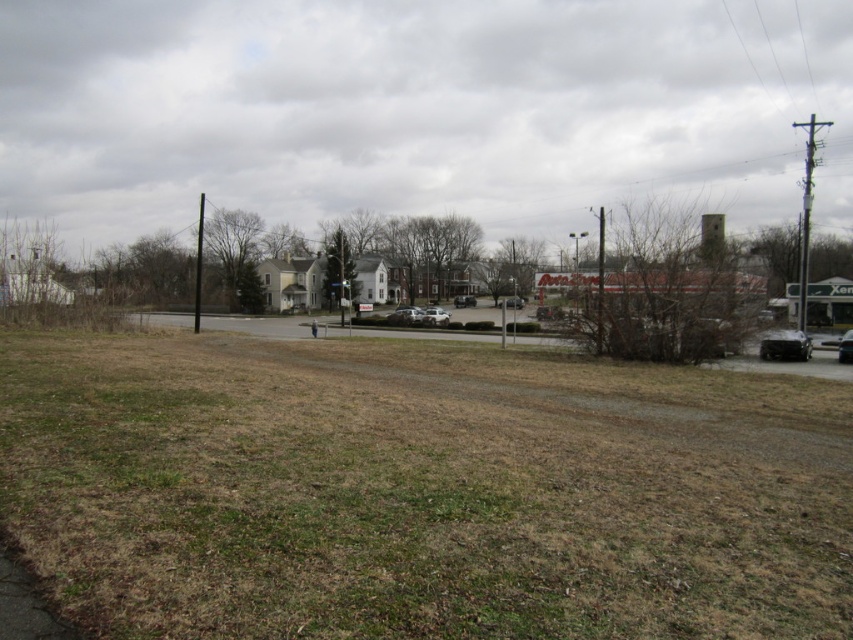
Question: Which point is farther to the camera?

Choices:
 (A) black matte car at lower right
 (B) silver metallic sedan at center
 (C) metallic silver sedan at right
 (D) metallic silver sedan at center

Answer: (D)

Question: Does silver metallic sedan at center appear on the left side of white matte van at center?

Choices:
 (A) no
 (B) yes

Answer: (B)

Question: Which point appears closest to the camera in this image?

Choices:
 (A) (386, 317)
 (B) (469, 305)
 (C) (846, 342)

Answer: (C)

Question: Does white matte van at center have a smaller size compared to metallic silver sedan at center?

Choices:
 (A) no
 (B) yes

Answer: (A)

Question: Which point is farther to the camera?

Choices:
 (A) (459, 298)
 (B) (838, 342)
 (C) (405, 312)

Answer: (A)

Question: Does black matte car at lower right have a larger size compared to matte silver sedan at center?

Choices:
 (A) no
 (B) yes

Answer: (A)